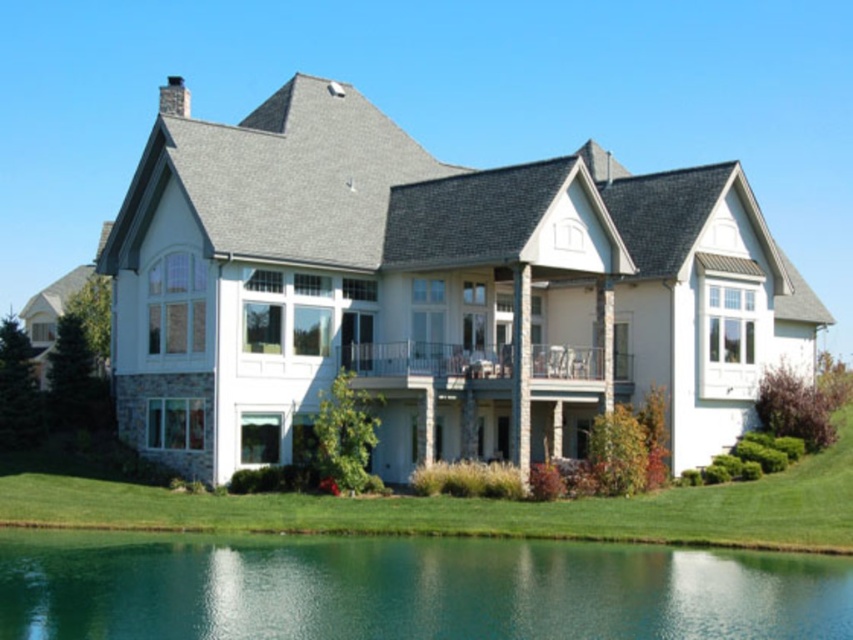
Question: Can you confirm if green liquid water at lower center is wider than green grass at lower center?

Choices:
 (A) no
 (B) yes

Answer: (A)

Question: Among these points, which one is nearest to the camera?

Choices:
 (A) (219, 545)
 (B) (804, 522)

Answer: (A)

Question: Can you confirm if green liquid water at lower center is positioned above green grass at lower center?

Choices:
 (A) yes
 (B) no

Answer: (B)

Question: Is green liquid water at lower center to the left of green grass at lower center from the viewer's perspective?

Choices:
 (A) yes
 (B) no

Answer: (A)

Question: Among these objects, which one is farthest from the camera?

Choices:
 (A) green liquid water at lower center
 (B) green grass at lower center

Answer: (B)